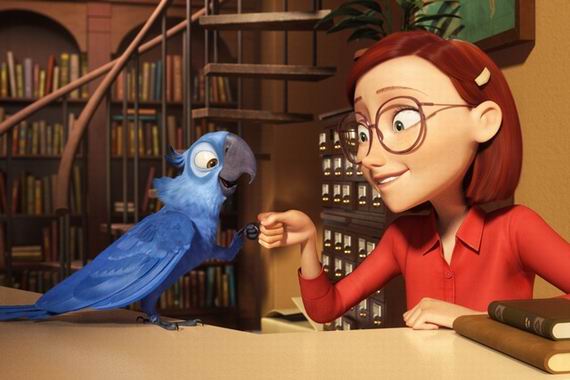
Find the location of `painting on wall`. painting on wall is located at coordinates (476, 16).